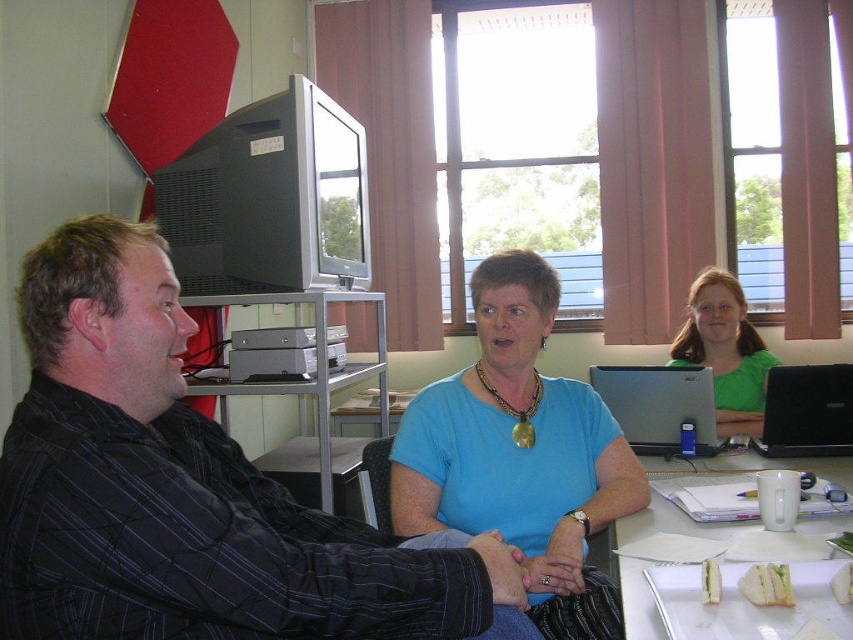
Question: Based on their relative distances, which object is farther from the black matte monitor at upper left?

Choices:
 (A) metallic gray table at center
 (B) blue fabric shirt at center
 (C) white paper plate at lower right

Answer: (C)

Question: Which point appears closest to the camera in this image?

Choices:
 (A) (840, 380)
 (B) (450, 522)

Answer: (B)

Question: Is the position of striped cotton shirt at center less distant than that of black matte monitor at upper left?

Choices:
 (A) yes
 (B) no

Answer: (A)

Question: Can you confirm if blue fabric shirt at center is positioned below black matte monitor at upper left?

Choices:
 (A) no
 (B) yes

Answer: (B)

Question: Which object is closer to the camera taking this photo?

Choices:
 (A) black plastic laptop at center right
 (B) white paper plate at lower right

Answer: (B)

Question: In this image, where is silver metallic laptop at center located relative to black plastic laptop at center right?

Choices:
 (A) above
 (B) below

Answer: (A)